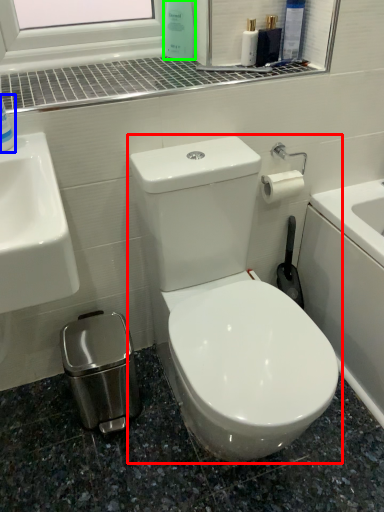
Question: Which object is the closest to the toilet (highlighted by a red box)? Choose among these: cleaning product (highlighted by a blue box) or cleaning product (highlighted by a green box).

Choices:
 (A) cleaning product
 (B) cleaning product

Answer: (A)